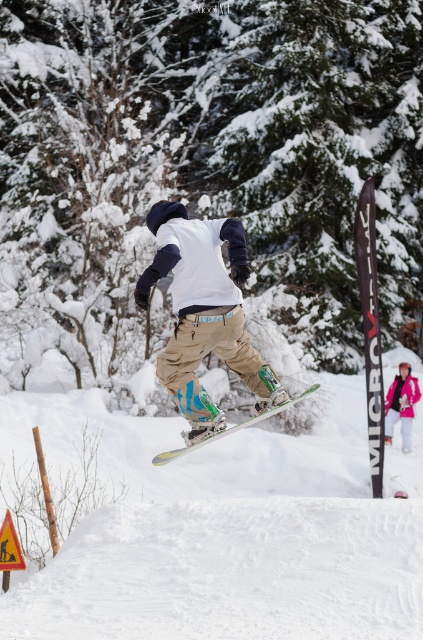
You are a photographer trying to capture the snowboarder in the image. You notice the green leafy tree at center and the pink fabric jacket at lower right. Which object should you focus on to ensure the snowboarder is in the foreground?

The pink fabric jacket at lower right should be focused on because it is in the foreground, while the green leafy tree at center is located above it and thus further away.

Based on the scene description, where is the green leafy tree at center located in terms of coordinates?

The green leafy tree at center is located at point coordinates of (213,150).